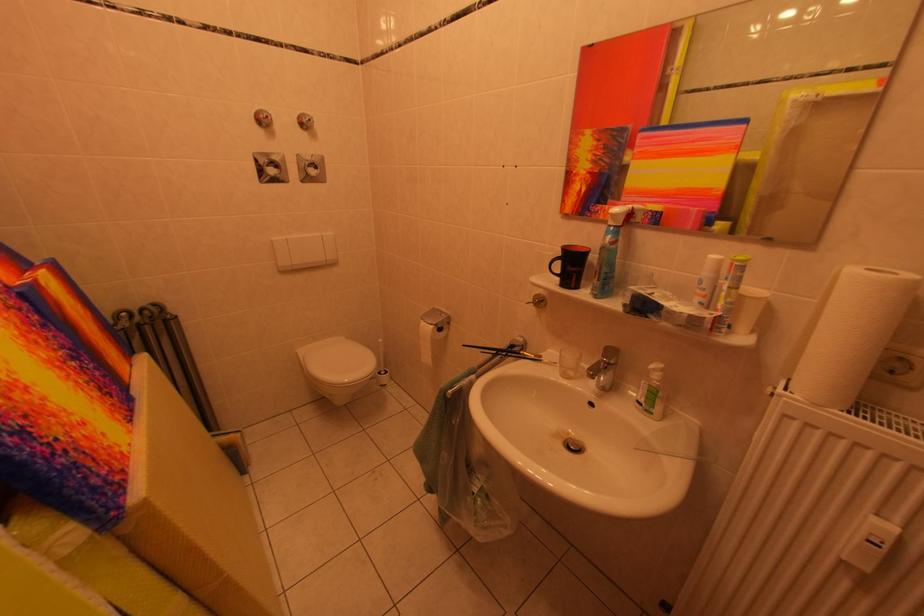
Identify the location of white soap dispenser pump. (609, 252).